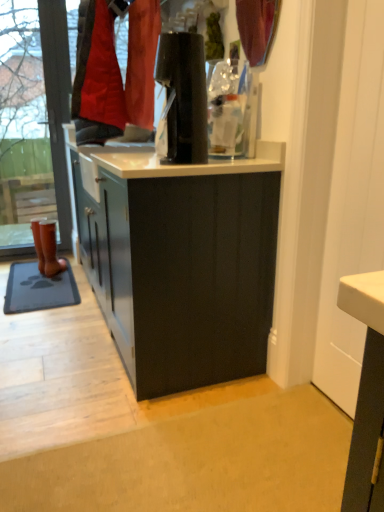
Question: From their relative heights in the image, would you say brown leather boot at left is taller or shorter than matte red curtain at upper center?

Choices:
 (A) short
 (B) tall

Answer: (B)

Question: From a real-world perspective, is brown leather boot at left positioned above or below matte red curtain at upper center?

Choices:
 (A) above
 (B) below

Answer: (B)

Question: Estimate the real-world distances between objects in this image. Which object is closer to the gray rubber mat at lower left?

Choices:
 (A) brown leather boot at left
 (B) transparent glass shop window at left
 (C) matte red curtain at upper center

Answer: (A)

Question: Which object is positioned farthest from the transparent glass shop window at left?

Choices:
 (A) gray rubber mat at lower left
 (B) brown leather boot at left
 (C) matte red curtain at upper center

Answer: (C)